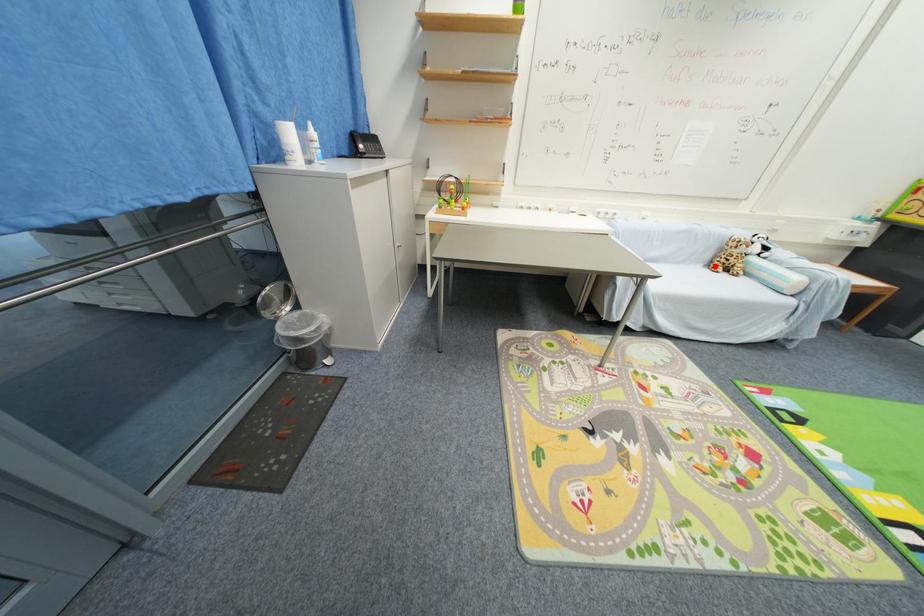
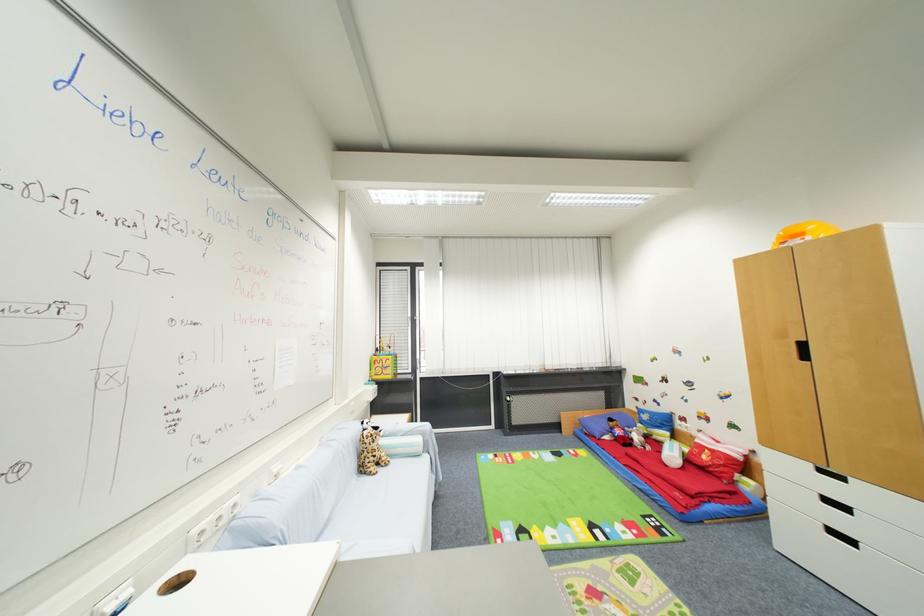
Locate, in the second image, the point that corresponds to the highlighted location in the first image.

(367, 472)